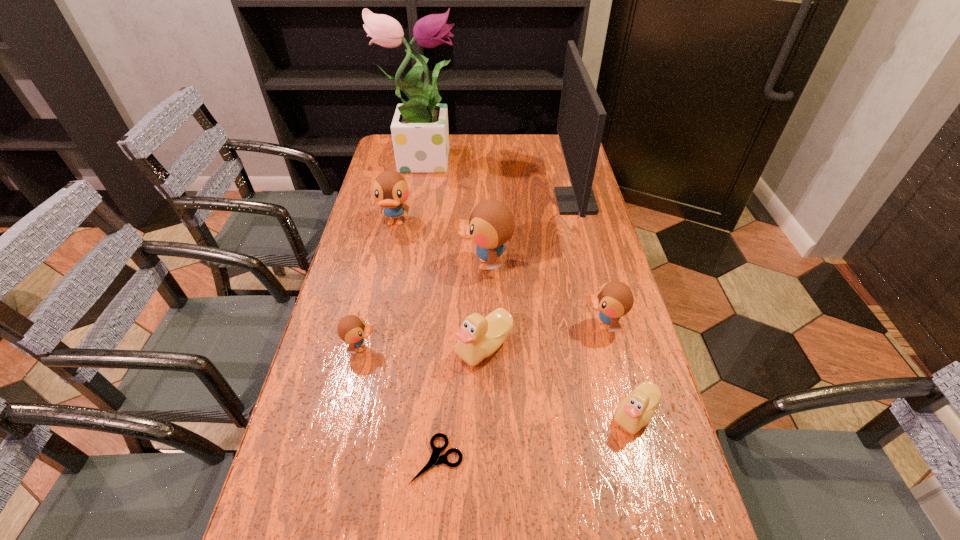
Identify the location of flower arrangement. (420, 134).

Find the location of a particular element. the tallest object is located at coordinates (420, 134).

Locate an element on the screen. This screenshot has width=960, height=540. computer monitor is located at coordinates (581, 120).

This screenshot has height=540, width=960. Find the location of `the tallest duck`. the tallest duck is located at coordinates (491, 224).

I want to click on the second blue duck from right to left, so coord(491,224).

Identify the location of the second tallest duck. (390, 189).

Where is `the farthest blue duck`? The width and height of the screenshot is (960, 540). the farthest blue duck is located at coordinates (390, 189).

You are a GUI agent. You are given a task and a screenshot of the screen. Output one action in this format:
    pyautogui.click(x=<x>, y=<y>)
    Task: Click on the third biggest blue duck
    The height and width of the screenshot is (540, 960).
    Given the screenshot: What is the action you would take?
    pyautogui.click(x=614, y=299)

Identify the location of the bigger beige duck. The image size is (960, 540). (479, 337).

Identify the location of the left beige duck. This screenshot has height=540, width=960. pos(479,337).